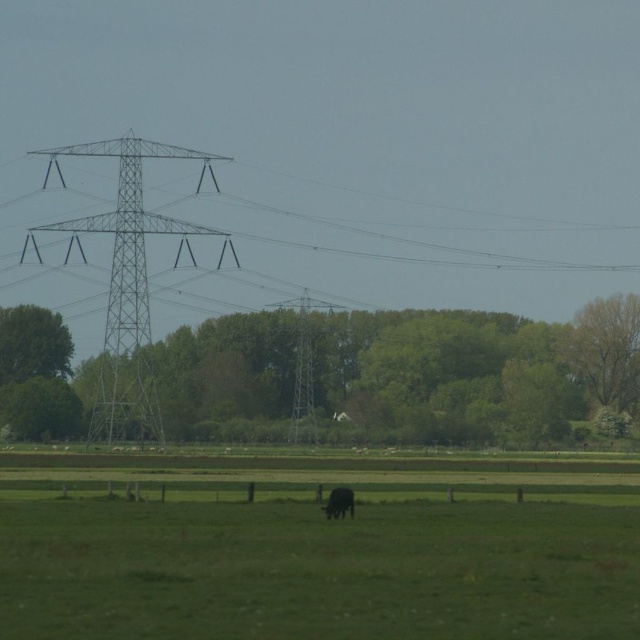
Is the position of green grass pasture at lower center more distant than that of metallic silver tower at center?

That is False.

Can you confirm if green grass pasture at lower center is positioned below metallic silver tower at center?

Correct, green grass pasture at lower center is located below metallic silver tower at center.

Is point (211, 512) less distant than point (305, 316)?

That is True.

The height and width of the screenshot is (640, 640). Identify the location of green grass pasture at lower center. (317, 547).

Is green grass pasture at lower center further to camera compared to black furry cow at lower center?

No, green grass pasture at lower center is closer to the viewer.

Can you confirm if green grass pasture at lower center is positioned above black furry cow at lower center?

Actually, green grass pasture at lower center is below black furry cow at lower center.

Does point (340, 577) come farther from viewer compared to point (337, 492)?

No, it is not.

At what (x,y) coordinates should I click in order to perform the action: click on green grass pasture at lower center. Please return your answer as a coordinate pair (x, y). This screenshot has height=640, width=640. Looking at the image, I should click on (317, 547).

Does metallic gray tower at left appear on the left side of black furry cow at lower center?

Indeed, metallic gray tower at left is positioned on the left side of black furry cow at lower center.

In the scene shown: Can you confirm if metallic gray tower at left is positioned to the right of black furry cow at lower center?

No, metallic gray tower at left is not to the right of black furry cow at lower center.

Where is `metallic gray tower at left`? Image resolution: width=640 pixels, height=640 pixels. metallic gray tower at left is located at coordinates (128, 284).

Locate an element on the screen. The image size is (640, 640). metallic gray tower at left is located at coordinates click(x=128, y=284).